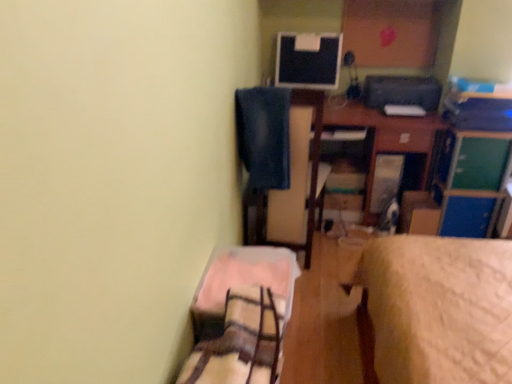
Question: From a real-world perspective, is wooden desk at center located beneath blue fabric swivel chair at upper center?

Choices:
 (A) no
 (B) yes

Answer: (B)

Question: Is blue fabric swivel chair at upper center located within wooden desk at center?

Choices:
 (A) no
 (B) yes

Answer: (A)

Question: Does wooden desk at center appear on the right side of blue fabric swivel chair at upper center?

Choices:
 (A) no
 (B) yes

Answer: (B)

Question: Is wooden desk at center further to camera compared to blue fabric swivel chair at upper center?

Choices:
 (A) yes
 (B) no

Answer: (A)

Question: Can you confirm if wooden desk at center is positioned to the left of blue fabric swivel chair at upper center?

Choices:
 (A) yes
 (B) no

Answer: (B)

Question: Is green matte file cabinet at upper right wider or thinner than matte black monitor at upper center?

Choices:
 (A) thin
 (B) wide

Answer: (B)

Question: Considering the positions of green matte file cabinet at upper right and matte black monitor at upper center in the image, is green matte file cabinet at upper right taller or shorter than matte black monitor at upper center?

Choices:
 (A) tall
 (B) short

Answer: (A)

Question: Considering the positions of green matte file cabinet at upper right and matte black monitor at upper center in the image, is green matte file cabinet at upper right bigger or smaller than matte black monitor at upper center?

Choices:
 (A) big
 (B) small

Answer: (A)

Question: From the image's perspective, is green matte file cabinet at upper right above or below matte black monitor at upper center?

Choices:
 (A) above
 (B) below

Answer: (B)

Question: From a real-world perspective, is cardboard box at center above or below plaid fabric bed at lower left?

Choices:
 (A) above
 (B) below

Answer: (B)

Question: In terms of height, does cardboard box at center look taller or shorter compared to plaid fabric bed at lower left?

Choices:
 (A) tall
 (B) short

Answer: (A)

Question: Considering the relative positions of cardboard box at center and plaid fabric bed at lower left in the image provided, is cardboard box at center to the left or to the right of plaid fabric bed at lower left?

Choices:
 (A) left
 (B) right

Answer: (B)

Question: Considering the positions of point (436, 213) and point (254, 294), is point (436, 213) closer or farther from the camera than point (254, 294)?

Choices:
 (A) farther
 (B) closer

Answer: (A)

Question: Is green matte file cabinet at upper right spatially inside blue fabric swivel chair at upper center, or outside of it?

Choices:
 (A) outside
 (B) inside

Answer: (A)

Question: Considering the positions of green matte file cabinet at upper right and blue fabric swivel chair at upper center in the image, is green matte file cabinet at upper right taller or shorter than blue fabric swivel chair at upper center?

Choices:
 (A) short
 (B) tall

Answer: (B)